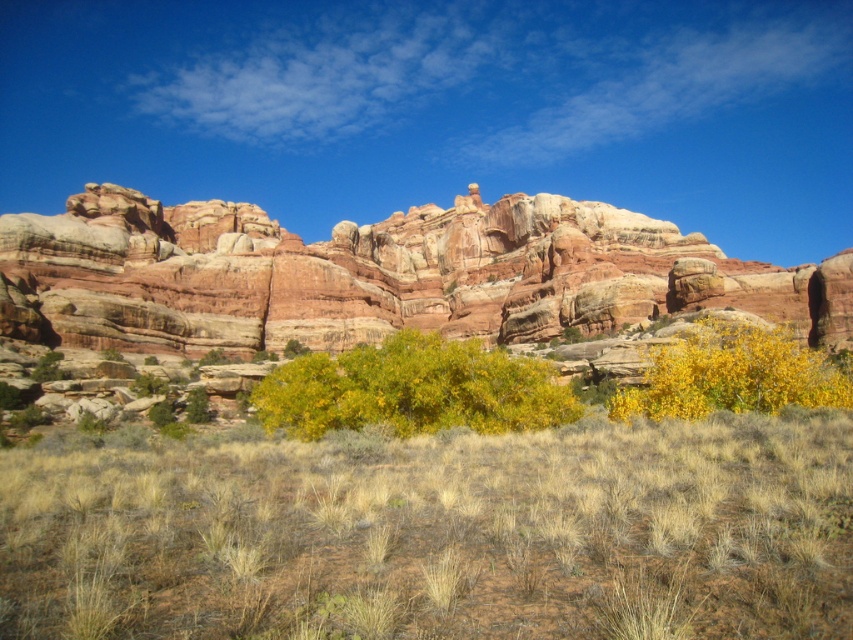
You are standing at the base of the desert rock formations and see two points marked in the image. One is at point (421, 406) and the other at point (764, 346). Which point is closer to you?

Point (764, 346) is closer to you because point (421, 406) is behind it.